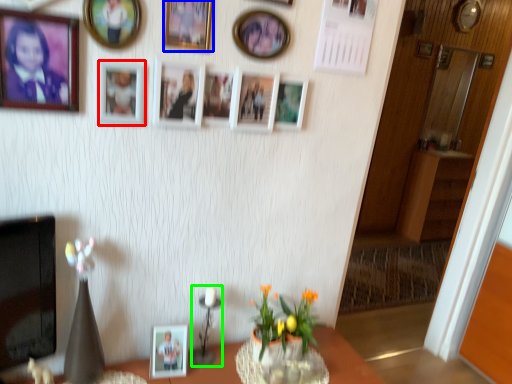
Question: Estimate the real-world distances between objects in this image. Which object is closer to picture frame (highlighted by a red box), picture frame (highlighted by a blue box) or candle holder (highlighted by a green box)?

Choices:
 (A) picture frame
 (B) candle holder

Answer: (A)